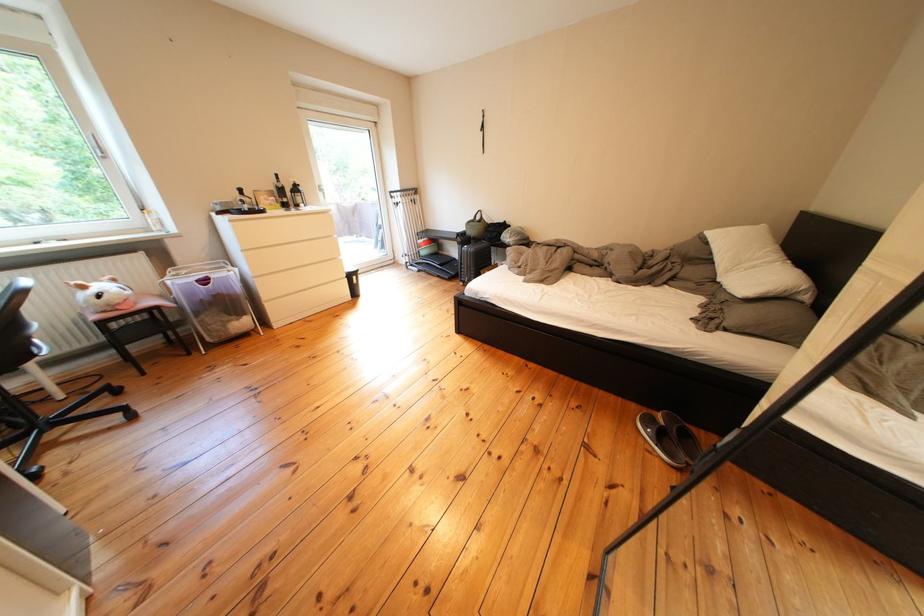
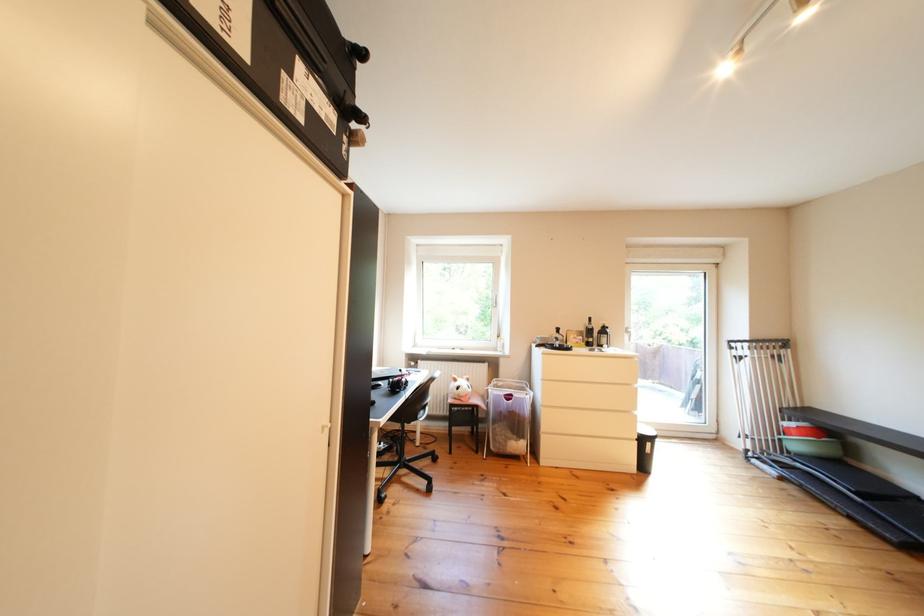
Question: The camera is either moving clockwise (left) or counter-clockwise (right) around the object. The first image is from the beginning of the video and the second image is from the end. Is the camera moving left or right when shooting the video?

Choices:
 (A) Left
 (B) Right

Answer: (B)